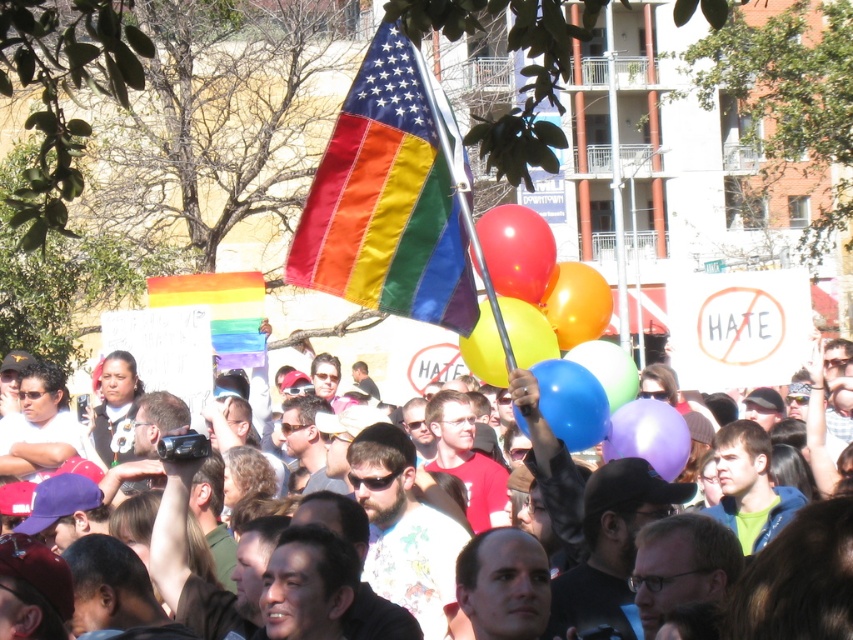
Question: Considering the relative positions of shiny red balloon at center and purple glossy balloon at center in the image provided, where is shiny red balloon at center located with respect to purple glossy balloon at center?

Choices:
 (A) below
 (B) above

Answer: (B)

Question: Which point appears farthest from the camera in this image?

Choices:
 (A) (509, 212)
 (B) (582, 413)
 (C) (550, 355)

Answer: (A)

Question: Does matte rainbow flag at upper center appear over purple glossy balloon at center?

Choices:
 (A) yes
 (B) no

Answer: (B)

Question: Does satin rainbow flag at center have a smaller size compared to translucent yellow balloon at center?

Choices:
 (A) no
 (B) yes

Answer: (A)

Question: Which of the following is the farthest from the observer?

Choices:
 (A) translucent multicolored balloons at center
 (B) purple glossy balloon at center
 (C) rubber balloon at center

Answer: (A)

Question: Which point is farther to the camera?

Choices:
 (A) blue glossy balloon at center
 (B) rubber balloon at center
 (C) purple glossy balloon at center
 (D) matte rainbow flag at upper center

Answer: (B)